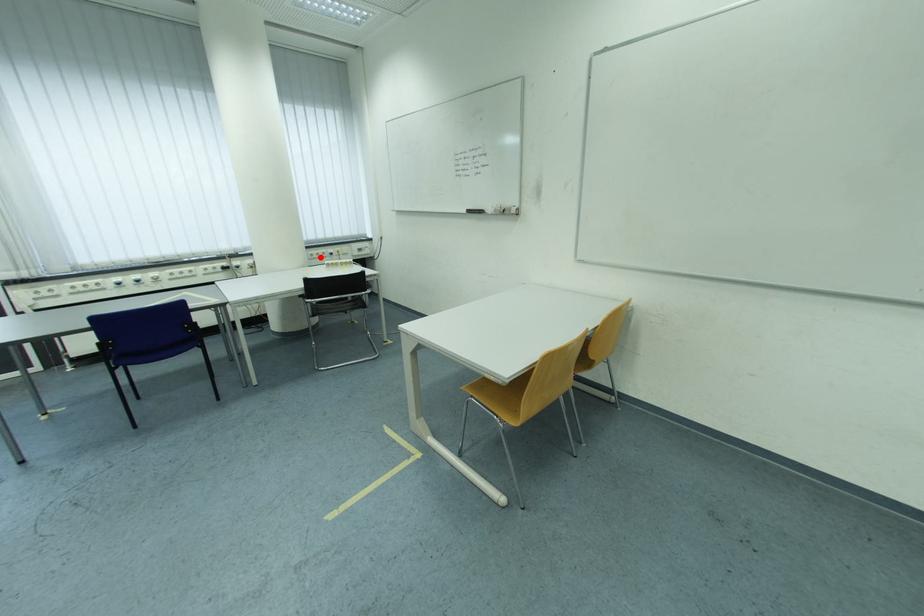
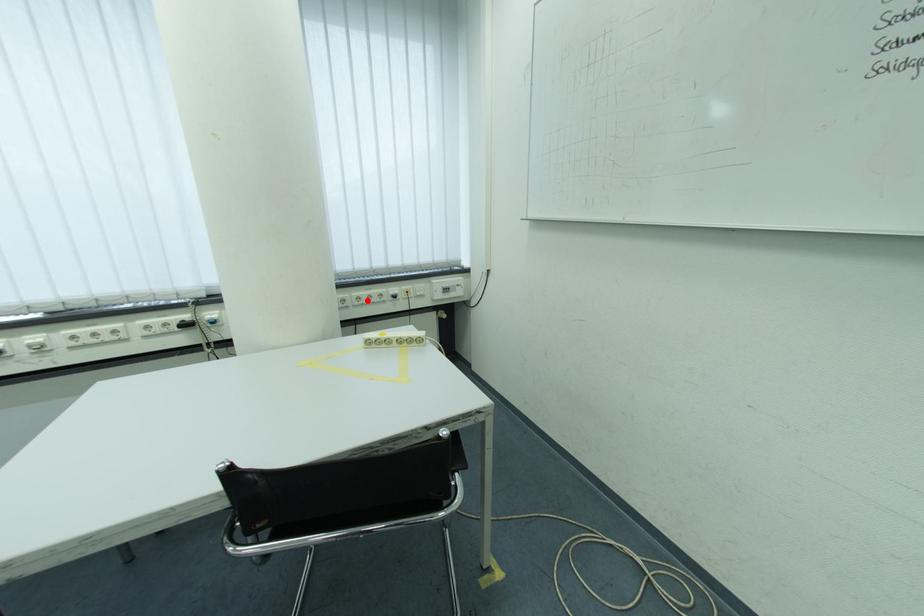
I am providing you with two images of the same scene from different viewpoints. A red point is marked on the first image and another point is marked on the second image. Is the marked point in image1 the same physical position as the marked point in image2?

Yes